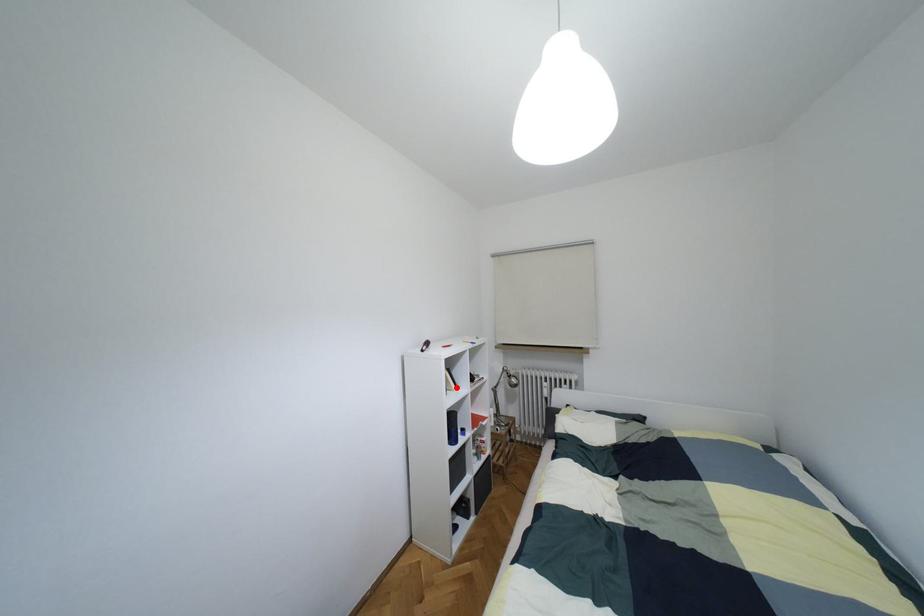
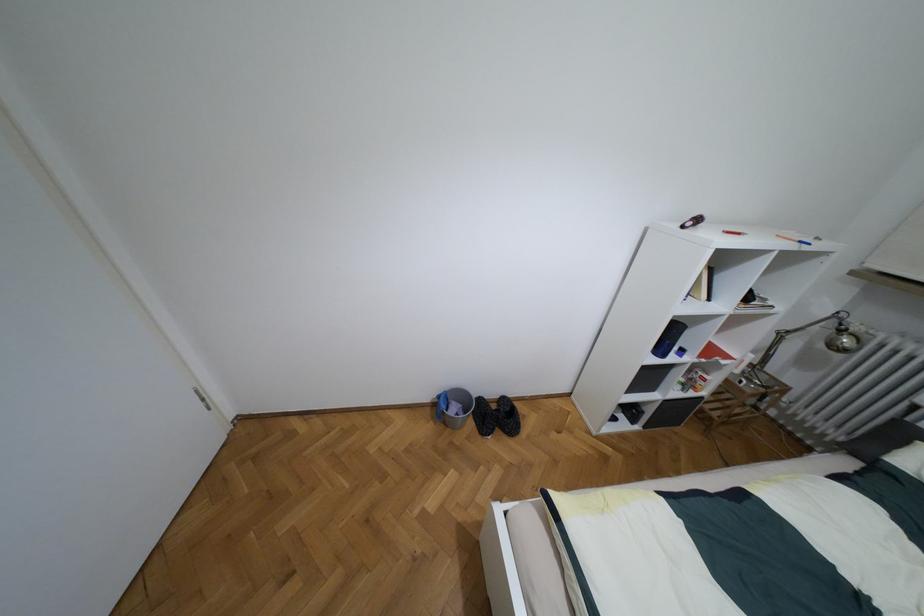
Where in the second image is the point corresponding to the highlighted location from the first image?

(709, 299)